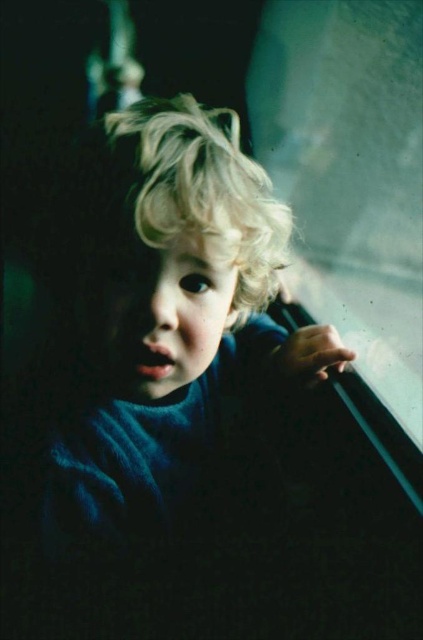
Is blue woolen sweater at center bigger than transparent glass train window at upper right?

No, blue woolen sweater at center is not bigger than transparent glass train window at upper right.

Between point (128, 422) and point (381, 22), which one is positioned in front?

Point (128, 422) is in front.

Is point (169, 353) less distant than point (371, 10)?

Yes.

I want to click on blue woolen sweater at center, so click(170, 320).

Does blue woolen sweater at center appear on the right side of blonde curly hair at center?

No, blue woolen sweater at center is not to the right of blonde curly hair at center.

Between point (150, 145) and point (167, 118), which one is positioned in front?

Point (150, 145) is in front.

Find the location of `blue woolen sweater at center`. blue woolen sweater at center is located at coordinates click(x=170, y=320).

Between transparent glass train window at upper right and blonde curly hair at center, which one has more height?

transparent glass train window at upper right is taller.

At what (x,y) coordinates should I click in order to perform the action: click on transparent glass train window at upper right. Please return your answer as a coordinate pair (x, y). The image size is (423, 640). Looking at the image, I should click on (351, 173).